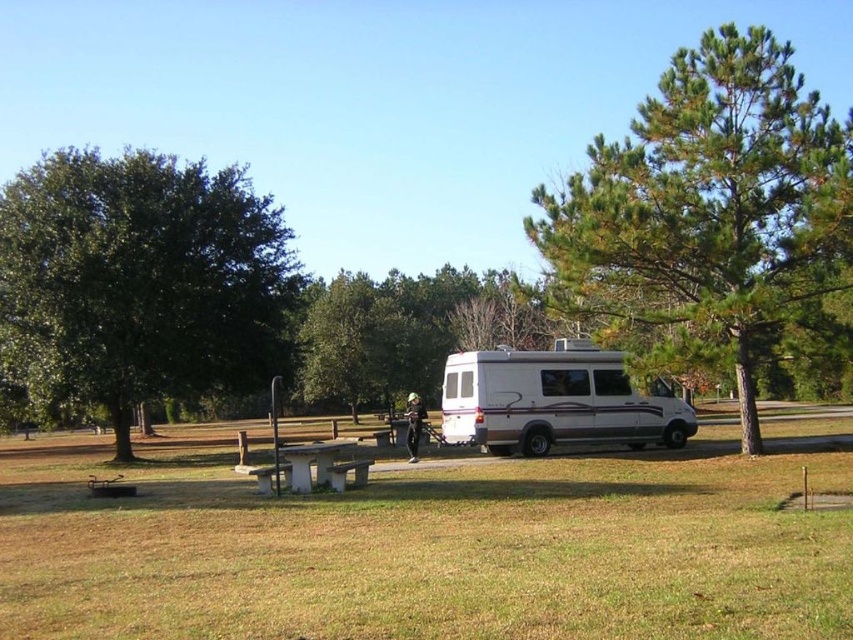
Does green leafy tree at center have a greater height compared to wooden park bench at center?

Yes.

This screenshot has width=853, height=640. Identify the location of green leafy tree at center. (403, 332).

Between point (514, 276) and point (367, 470), which one is positioned behind?

The point (514, 276) is behind.

Find the location of a particular element. green leafy tree at center is located at coordinates click(403, 332).

Can you confirm if green leafy tree at left is shorter than white glossy van at center?

No.

Identify the location of green leafy tree at left. The height and width of the screenshot is (640, 853). (141, 278).

Can you confirm if green grass at center is positioned below wooden park bench at center?

Indeed, green grass at center is positioned under wooden park bench at center.

In the scene shown: Between green grass at center and wooden park bench at center, which one appears on the right side from the viewer's perspective?

Positioned to the right is green grass at center.

The image size is (853, 640). What do you see at coordinates (450, 550) in the screenshot? I see `green grass at center` at bounding box center [450, 550].

Locate an element on the screen. The image size is (853, 640). green grass at center is located at coordinates (450, 550).